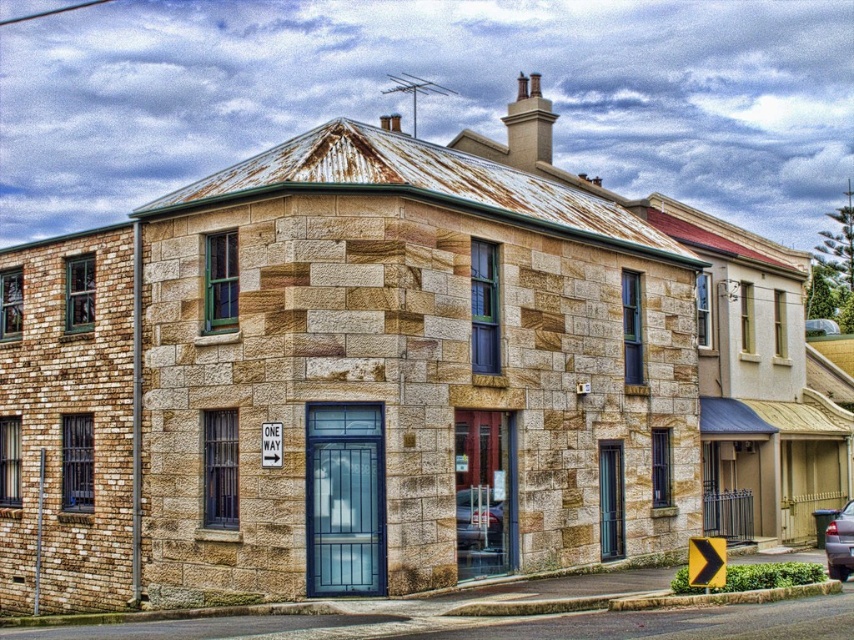
Question: Among these objects, which one is nearest to the camera?

Choices:
 (A) metallic silver car at center
 (B) metallic silver sedan at lower right

Answer: (A)

Question: Is metallic silver car at center to the left of metallic silver sedan at lower right from the viewer's perspective?

Choices:
 (A) no
 (B) yes

Answer: (B)

Question: Is metallic silver car at center further to camera compared to metallic silver sedan at lower right?

Choices:
 (A) yes
 (B) no

Answer: (B)

Question: Is metallic silver car at center wider than metallic silver sedan at lower right?

Choices:
 (A) no
 (B) yes

Answer: (A)